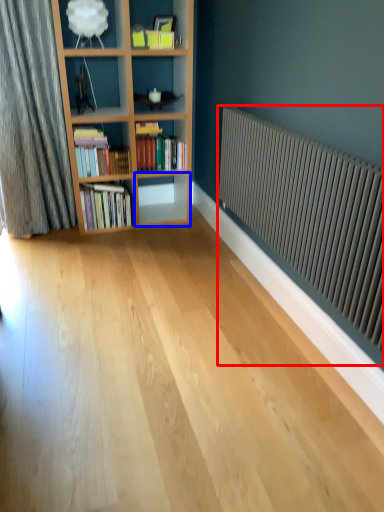
Question: Among these objects, which one is farthest to the camera, radiator (highlighted by a red box) or shelf (highlighted by a blue box)?

Choices:
 (A) radiator
 (B) shelf

Answer: (B)